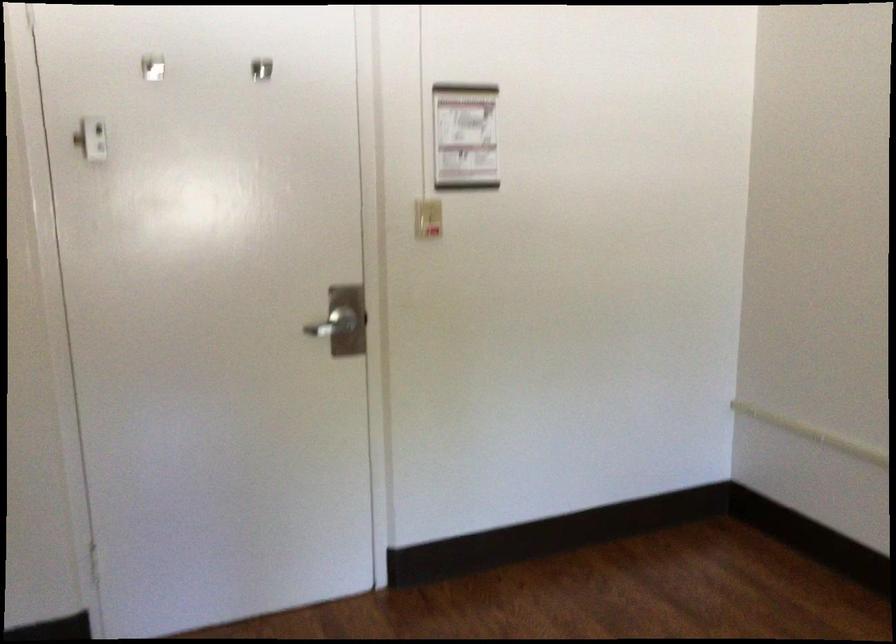
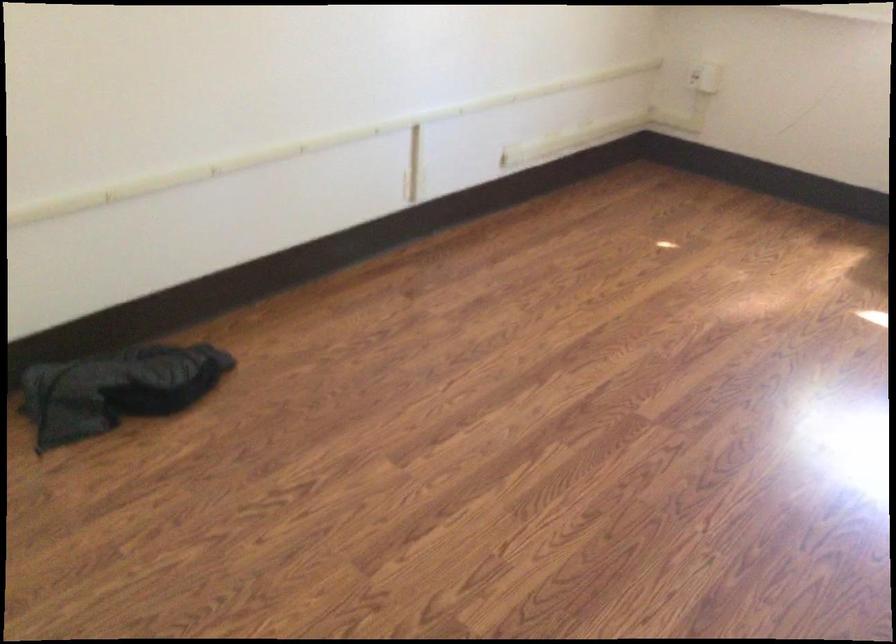
From the picture: The first image is from the beginning of the video and the second image is from the end. How did the camera likely rotate when shooting the video?

The rotation direction of the camera is right-down.